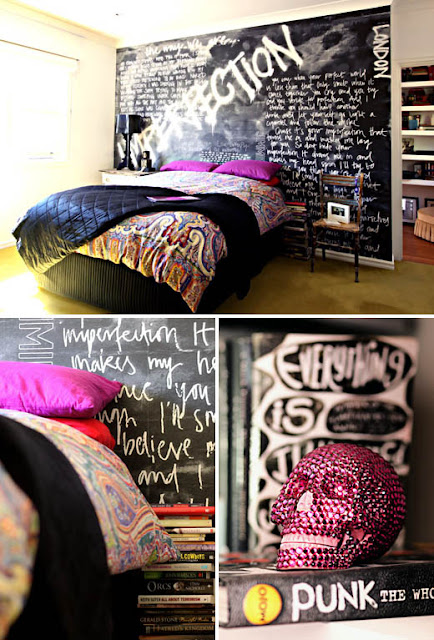
Find the location of `shelves`. shelves is located at coordinates (423, 81), (419, 108), (417, 132), (418, 156), (415, 180).